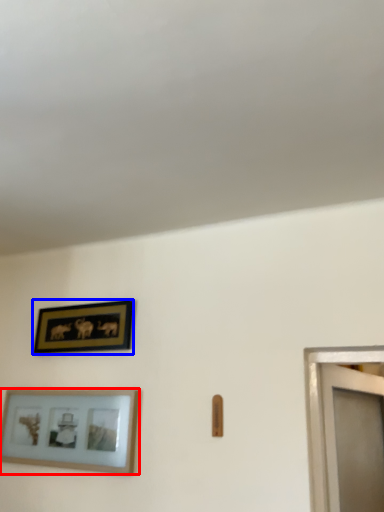
Question: Which of the following is the closest to the observer, picture frame (highlighted by a red box) or picture frame (highlighted by a blue box)?

Choices:
 (A) picture frame
 (B) picture frame

Answer: (A)